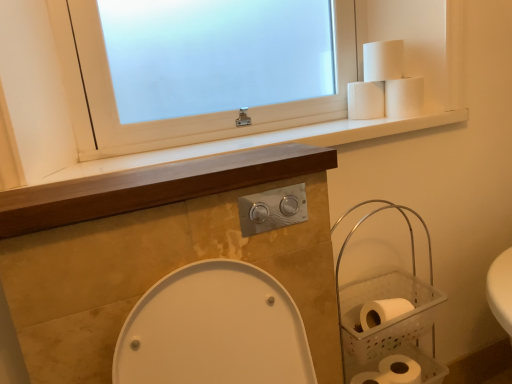
Question: From the image's perspective, does white matte toilet paper at upper right, the 2th toilet paper from the top, appear lower than white frosted glass window at upper center?

Choices:
 (A) yes
 (B) no

Answer: (A)

Question: Is white matte toilet paper at upper right, the 2th toilet paper from the top, taller than white frosted glass window at upper center?

Choices:
 (A) yes
 (B) no

Answer: (B)

Question: Is white matte toilet paper at upper right, the 2th toilet paper from the top, next to white frosted glass window at upper center?

Choices:
 (A) yes
 (B) no

Answer: (B)

Question: Does white matte toilet paper at upper right, the 2th toilet paper from the top, turn towards white frosted glass window at upper center?

Choices:
 (A) yes
 (B) no

Answer: (B)

Question: Does white matte toilet paper at upper right, which is the third toilet paper from bottom to top, appear on the right side of white frosted glass window at upper center?

Choices:
 (A) no
 (B) yes

Answer: (B)

Question: Looking at the image, does clear plastic basket at right seem bigger or smaller compared to wooden at center?

Choices:
 (A) big
 (B) small

Answer: (A)

Question: In the image, is clear plastic basket at right positioned in front of or behind wooden at center?

Choices:
 (A) behind
 (B) front

Answer: (A)

Question: From a real-world perspective, is clear plastic basket at right above or below wooden at center?

Choices:
 (A) below
 (B) above

Answer: (A)

Question: Which is correct: clear plastic basket at right is inside wooden at center, or outside of it?

Choices:
 (A) inside
 (B) outside

Answer: (B)

Question: In the image, is white matte toilet paper at lower right, the 1th toilet paper in the bottom-to-top sequence, positioned in front of or behind white matte toilet paper at upper right, the 2th toilet paper positioned from the bottom?

Choices:
 (A) front
 (B) behind

Answer: (A)

Question: Based on their sizes in the image, would you say white matte toilet paper at lower right, the 4th toilet paper positioned from the top, is bigger or smaller than white matte toilet paper at upper right, the 2th toilet paper positioned from the bottom?

Choices:
 (A) small
 (B) big

Answer: (A)

Question: Is point (402, 370) closer or farther from the camera than point (404, 100)?

Choices:
 (A) farther
 (B) closer

Answer: (B)

Question: Is white matte toilet paper at lower right, the 1th toilet paper in the bottom-to-top sequence, inside the boundaries of white matte toilet paper at upper right, which is the third toilet paper in top-to-bottom order, or outside?

Choices:
 (A) outside
 (B) inside

Answer: (A)

Question: Based on their sizes in the image, would you say white matte toilet paper at lower right, the 1th toilet paper in the bottom-to-top sequence, is bigger or smaller than clear plastic basket at right?

Choices:
 (A) big
 (B) small

Answer: (B)

Question: From the image's perspective, is white matte toilet paper at lower right, the 4th toilet paper positioned from the top, located above or below clear plastic basket at right?

Choices:
 (A) below
 (B) above

Answer: (A)